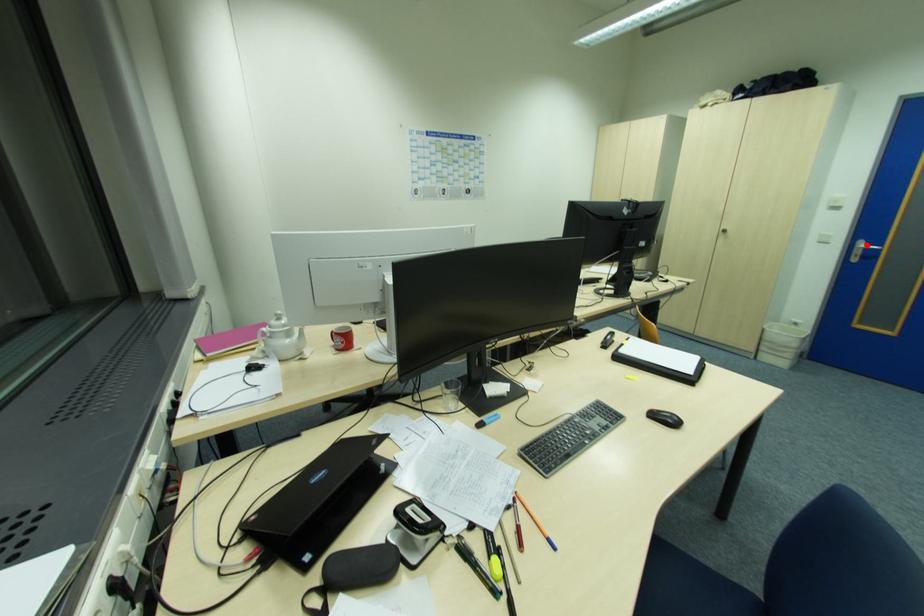
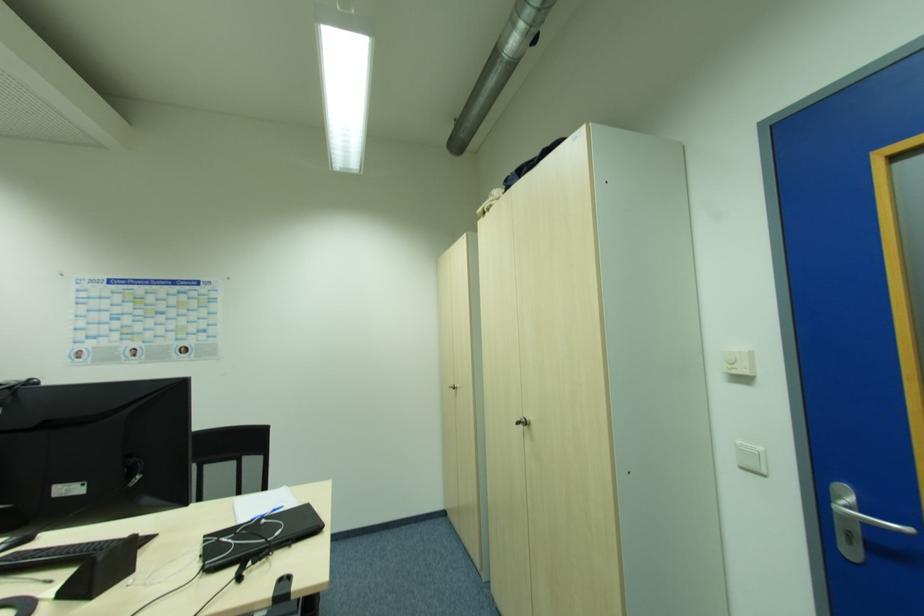
Find the pixel in the second image that matches the highlighted location in the first image.

(855, 501)